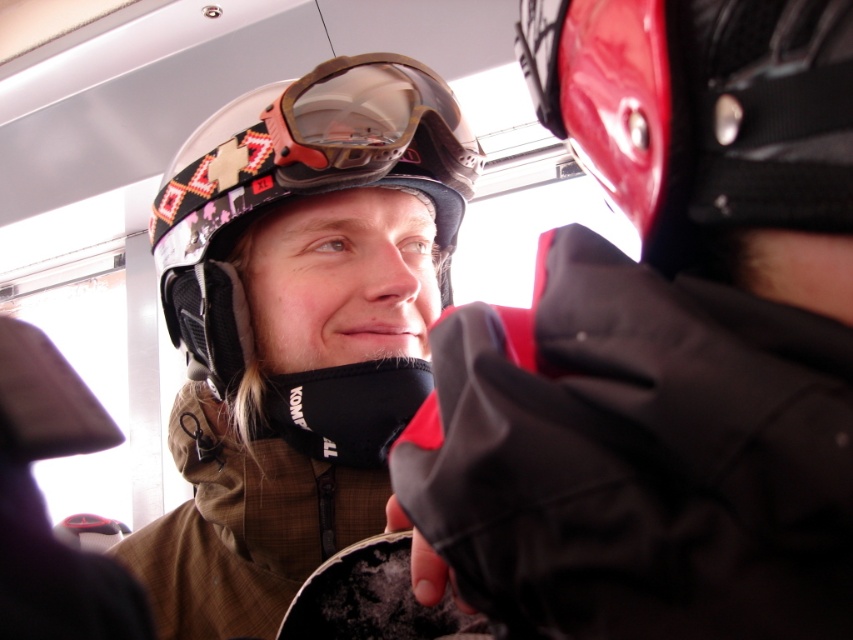
Question: Which point appears closest to the camera in this image?

Choices:
 (A) (305, 147)
 (B) (306, 189)
 (C) (614, 22)

Answer: (C)

Question: In this image, where is white matte helmet at center located relative to matte black goggles at center?

Choices:
 (A) right
 (B) left

Answer: (B)

Question: Is matte black helmet at upper left wider than white matte helmet at center?

Choices:
 (A) no
 (B) yes

Answer: (A)

Question: Which is farther from the red matte helmet at upper right?

Choices:
 (A) white matte helmet at center
 (B) matte black helmet at upper left
 (C) matte black goggles at center

Answer: (A)

Question: Which point is closer to the camera?

Choices:
 (A) matte black helmet at upper left
 (B) red matte helmet at upper right
 (C) white matte helmet at center
 (D) matte black goggles at center

Answer: (A)

Question: Is matte black helmet at upper left further to camera compared to red matte helmet at upper right?

Choices:
 (A) no
 (B) yes

Answer: (A)